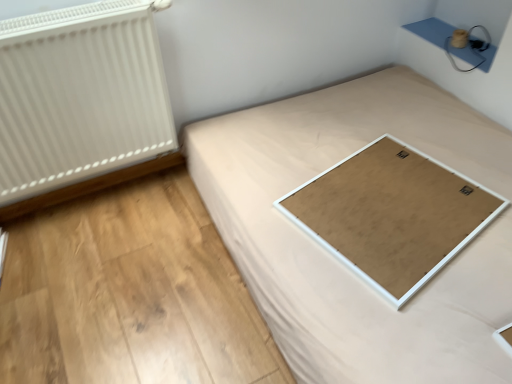
Identify the location of white textured radiator at left. (80, 95).

Could you tell me if white textured radiator at left is turned towards natural wood plywood at lower center?

No, white textured radiator at left is not oriented towards natural wood plywood at lower center.

From a real-world perspective, is white textured radiator at left physically above natural wood plywood at lower center?

Yes.

From the image's perspective, between white textured radiator at left and natural wood plywood at lower center, which one is located above?

From the image's view, white textured radiator at left is above.

Could natural wood plywood at lower center be considered to be inside white textured radiator at left?

Actually, natural wood plywood at lower center is outside white textured radiator at left.

Visually, is white matte board at center positioned to the left or to the right of white matte board at center?

In the image, white matte board at center appears on the left side of white matte board at center.

Considering the sizes of objects white matte board at center and white matte board at center in the image provided, who is taller, white matte board at center or white matte board at center?

white matte board at center is taller.

Which is correct: white matte board at center is inside white matte board at center, or outside of it?

white matte board at center is inside white matte board at center.

Considering the positions of points (327, 214) and (303, 110), is point (327, 214) closer to camera compared to point (303, 110)?

That is True.

From the image's perspective, would you say white matte board at center is positioned over natural wood plywood at lower center?

Yes, from the image's perspective, white matte board at center is above natural wood plywood at lower center.

From a real-world perspective, who is located lower, white matte board at center or natural wood plywood at lower center?

From a 3D spatial view, natural wood plywood at lower center is below.

Are white matte board at center and natural wood plywood at lower center located far from each other?

That's not correct — white matte board at center is a little close to natural wood plywood at lower center.

Can you tell me how much white matte board at center and natural wood plywood at lower center differ in facing direction?

They differ by 104 degrees in their facing directions.

Based on their sizes in the image, would you say natural wood plywood at lower center is bigger or smaller than white matte board at center?

In the image, natural wood plywood at lower center appears to be larger than white matte board at center.

Is the depth of natural wood plywood at lower center greater than that of white matte board at center?

No, natural wood plywood at lower center is in front of white matte board at center.

Where is `plywood below the white matte board at center (from a real-world perspective)`? This screenshot has height=384, width=512. plywood below the white matte board at center (from a real-world perspective) is located at coordinates (130, 294).

From the image's perspective, is natural wood plywood at lower center above or below white matte board at center?

Based on their image positions, natural wood plywood at lower center is located beneath white matte board at center.

Is white matte board at center far away from white textured radiator at left?

No, there isn't a large distance between white matte board at center and white textured radiator at left.

Would you say white matte board at center is inside or outside white textured radiator at left?

white matte board at center cannot be found inside white textured radiator at left.

From a real-world perspective, is white matte board at center positioned above or below white textured radiator at left?

Clearly, from a real-world perspective, white matte board at center is below white textured radiator at left.

Is the position of white matte board at center less distant than that of white textured radiator at left?

Yes, it is in front of white textured radiator at left.

Is white textured radiator at left next to white matte board at center and touching it?

No, white textured radiator at left is not in contact with white matte board at center.

From the image's perspective, who appears lower, white textured radiator at left or white matte board at center?

white matte board at center is shown below in the image.

Based on their positions, is white textured radiator at left located to the left or right of white matte board at center?

white textured radiator at left is to the left of white matte board at center.

Is point (133, 331) positioned before point (420, 359)?

That is False.

Would you say natural wood plywood at lower center is outside white matte board at center?

Yes, natural wood plywood at lower center is located beyond the bounds of white matte board at center.

Is natural wood plywood at lower center turned away from white matte board at center?

No.

You are a GUI agent. You are given a task and a screenshot of the screen. Output one action in this format:
    pyautogui.click(x=<x>, y=<y>)
    Task: Click on the radiator behind the natural wood plywood at lower center
    
    Given the screenshot: What is the action you would take?
    pyautogui.click(x=80, y=95)

The image size is (512, 384). What are the coordinates of `table above the white matte board at center (from the image's perspective)` in the screenshot? It's located at coord(392,215).

Considering their positions, is natural wood plywood at lower center positioned further to white matte board at center than white matte board at center?

natural wood plywood at lower center is positioned further to the anchor white matte board at center.

Which object lies further to the anchor point white matte board at center, white textured radiator at left or natural wood plywood at lower center?

Among the two, white textured radiator at left is located further to white matte board at center.

Which object lies further to the anchor point white matte board at center, white textured radiator at left or natural wood plywood at lower center?

white textured radiator at left is positioned further to the anchor white matte board at center.

Estimate the real-world distances between objects in this image. Which object is further from white textured radiator at left, white matte board at center or natural wood plywood at lower center?

Among the two, white matte board at center is located further to white textured radiator at left.

Considering their positions, is white textured radiator at left positioned closer to natural wood plywood at lower center than white matte board at center?

white matte board at center is closer to natural wood plywood at lower center.

Estimate the real-world distances between objects in this image. Which object is further from natural wood plywood at lower center, white matte board at center or white matte board at center?

Based on the image, white matte board at center appears to be further to natural wood plywood at lower center.

Based on their spatial positions, is natural wood plywood at lower center or white matte board at center further from white textured radiator at left?

white matte board at center is further to white textured radiator at left.

Which object lies further to the anchor point natural wood plywood at lower center, white textured radiator at left or white matte board at center?

white matte board at center lies further to natural wood plywood at lower center than the other object.

Identify the location of plywood between white textured radiator at left and white matte board at center in the horizontal direction. (130, 294).

Where is `table between natural wood plywood at lower center and white matte board at center from left to right`? Image resolution: width=512 pixels, height=384 pixels. table between natural wood plywood at lower center and white matte board at center from left to right is located at coordinates (392, 215).

This screenshot has width=512, height=384. Identify the location of plywood between white textured radiator at left and white matte board at center from left to right. (130, 294).

Find the location of a particular element. table between white textured radiator at left and white matte board at center in the horizontal direction is located at coordinates (392, 215).